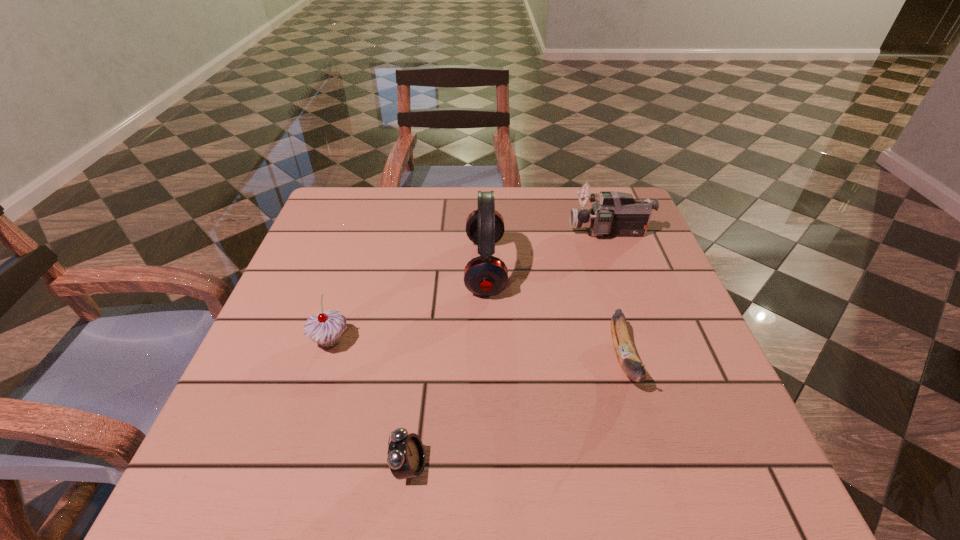
Locate an element on the screen. the tallest object is located at coordinates (485, 275).

I want to click on earphone, so click(485, 275).

I want to click on camcorder, so click(x=614, y=214).

Where is `cupcake`? Image resolution: width=960 pixels, height=540 pixels. cupcake is located at coordinates (325, 328).

Identify the location of banana. The height and width of the screenshot is (540, 960). (629, 361).

The height and width of the screenshot is (540, 960). I want to click on the nearest object, so click(406, 456).

You are a GUI agent. You are given a task and a screenshot of the screen. Output one action in this format:
    pyautogui.click(x=<x>, y=<y>)
    Task: Click on the fourth object from right to left
    This screenshot has width=960, height=540.
    Given the screenshot: What is the action you would take?
    pyautogui.click(x=406, y=456)

Locate an element on the screen. free space located 0.240m on the ear cups of the tallest object is located at coordinates (362, 267).

At what (x,y) coordinates should I click in order to perform the action: click on vacant space positioned 0.260m on the ear cups of the tallest object. Please return your answer as a coordinate pair (x, y). Looking at the image, I should click on (353, 267).

Identify the location of vacant space positioned 0.140m on the ear cups of the tallest object. (405, 267).